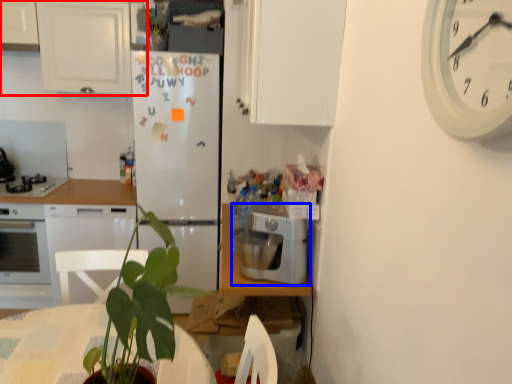
Question: Which object is closer to the camera taking this photo, cabinetry (highlighted by a red box) or kitchen appliance (highlighted by a blue box)?

Choices:
 (A) cabinetry
 (B) kitchen appliance

Answer: (B)